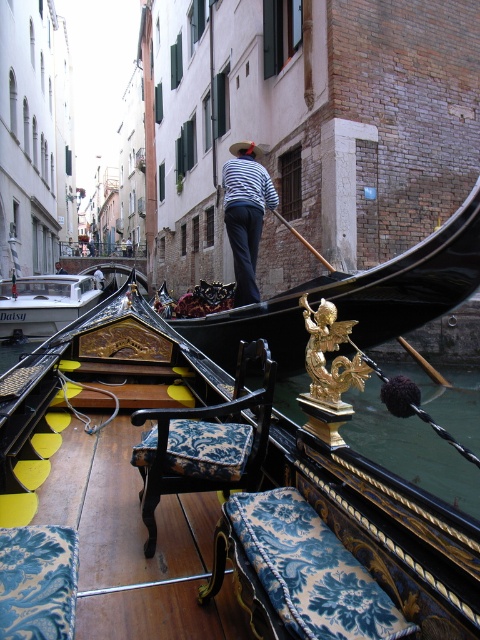
Question: Which of the following is the farthest from the observer?

Choices:
 (A) (36, 296)
 (B) (356, 564)

Answer: (A)

Question: Can you confirm if blue damask cushion at center is positioned below white glossy motorboat at center?

Choices:
 (A) yes
 (B) no

Answer: (A)

Question: Which is nearer to the blue damask cushion at center?

Choices:
 (A) striped fabric shirt at center
 (B) white glossy motorboat at center
 (C) gold ornate gondola at center
 (D) striped fabric shirt at upper center

Answer: (C)

Question: Can you confirm if gold ornate gondola at center is wider than striped fabric shirt at upper center?

Choices:
 (A) yes
 (B) no

Answer: (B)

Question: Which point is farther to the camera?

Choices:
 (A) tap(49, 292)
 (B) tap(325, 554)
 (C) tap(95, 280)

Answer: (C)

Question: Is gold ornate gondola at center bigger than striped fabric shirt at upper center?

Choices:
 (A) yes
 (B) no

Answer: (B)